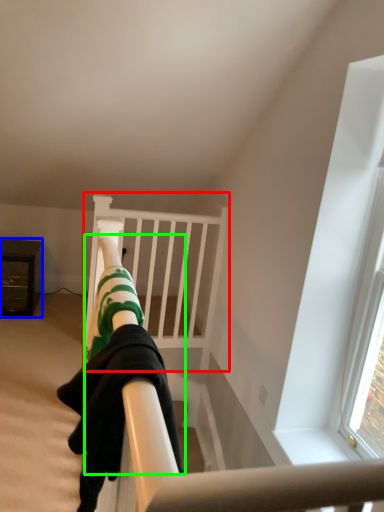
Question: Estimate the real-world distances between objects in this image. Which object is farther from bunk bed (highlighted by a red box), furniture (highlighted by a blue box) or person (highlighted by a green box)?

Choices:
 (A) furniture
 (B) person

Answer: (B)